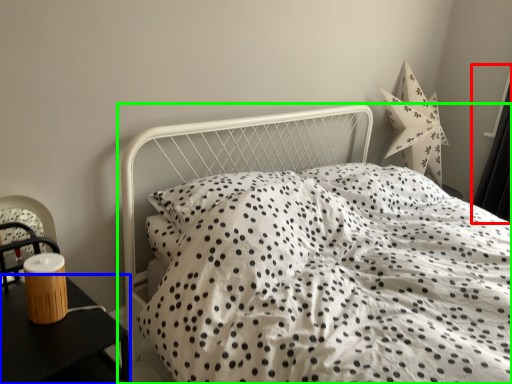
Question: Based on their relative distances, which object is nearer to curtain (highlighted by a red box)? Choose from nightstand (highlighted by a blue box) and bed (highlighted by a green box).

Choices:
 (A) nightstand
 (B) bed

Answer: (B)